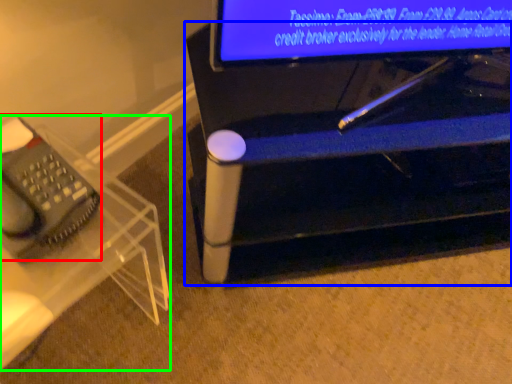
Question: Considering the real-world distances, which object is farthest from equipment (highlighted by a red box)? furniture (highlighted by a blue box) or furniture (highlighted by a green box)?

Choices:
 (A) furniture
 (B) furniture

Answer: (A)